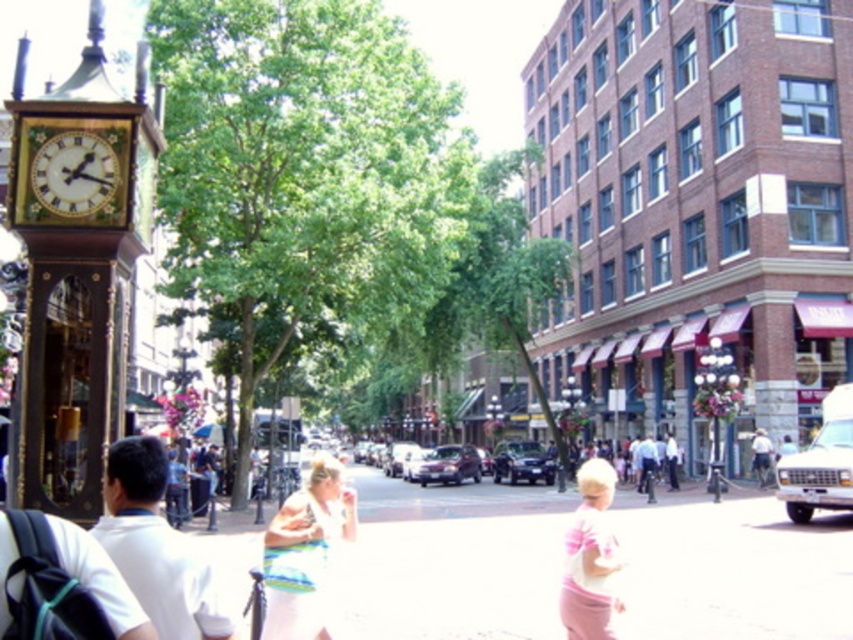
Measure the distance between beige fabric bag at center and camera.

They are 26.82 meters apart.

Is point (277, 540) farther from camera compared to point (44, 179)?

Yes.

What do you see at coordinates (305, 552) in the screenshot?
I see `beige fabric bag at center` at bounding box center [305, 552].

I want to click on beige fabric bag at center, so click(x=305, y=552).

Consider the image. Does wooden clock at left have a greater height compared to gold wooden clock at left?

Correct, wooden clock at left is much taller as gold wooden clock at left.

Is point (93, 65) behind point (80, 132)?

That is True.

Who is more distant from viewer, (115, 289) or (108, 170)?

The point (115, 289) is more distant.

The height and width of the screenshot is (640, 853). Identify the location of wooden clock at left. (77, 268).

Can you confirm if beige fabric bag at center is shorter than pink fabric at lower right?

No.

Which is behind, point (315, 625) or point (585, 554)?

Positioned behind is point (585, 554).

Locate an element on the screen. beige fabric bag at center is located at coordinates (305, 552).